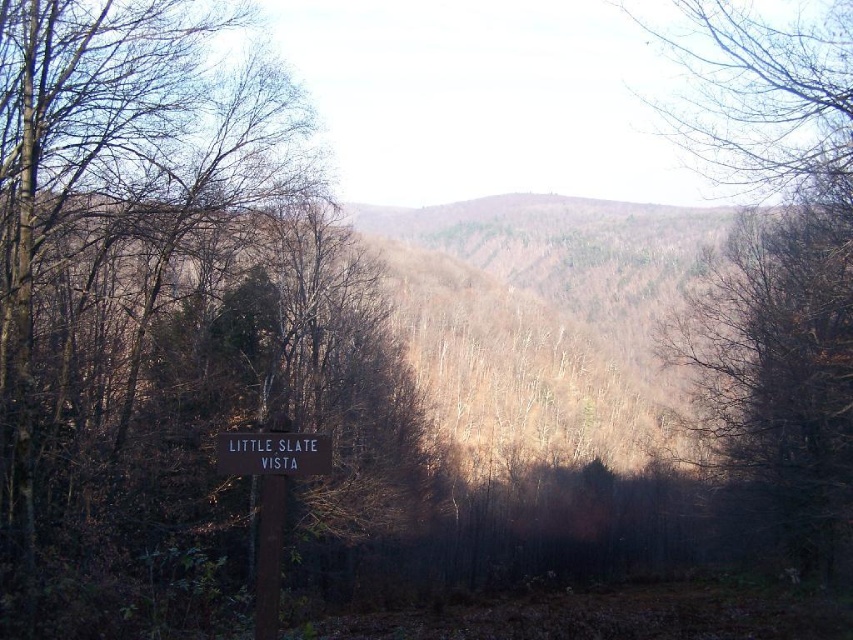
Question: Which point is farther to the camera?

Choices:
 (A) (326, 461)
 (B) (265, 449)
 (C) (807, 316)

Answer: (C)

Question: Which object appears farthest from the camera in this image?

Choices:
 (A) black wood sign at center
 (B) brown matte tree at right
 (C) brown wooden sign at lower center

Answer: (B)

Question: Is brown matte tree at right further to the viewer compared to black wood sign at center?

Choices:
 (A) yes
 (B) no

Answer: (A)

Question: Can you confirm if brown matte tree at right is positioned to the left of brown wooden sign at lower center?

Choices:
 (A) yes
 (B) no

Answer: (B)

Question: Is brown wooden sign at lower center to the right of black wood sign at center from the viewer's perspective?

Choices:
 (A) no
 (B) yes

Answer: (A)

Question: Among these points, which one is nearest to the camera?

Choices:
 (A) (668, 113)
 (B) (265, 449)

Answer: (B)